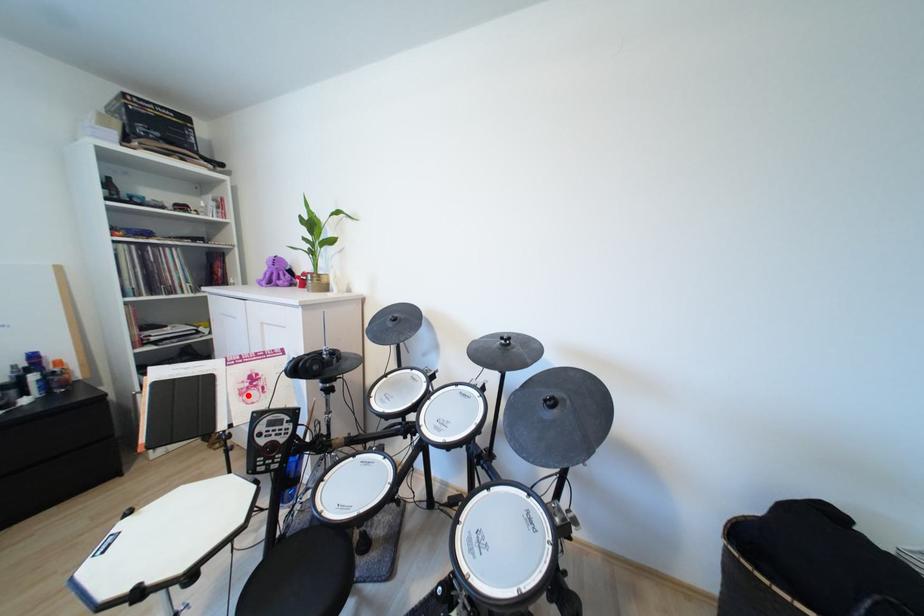
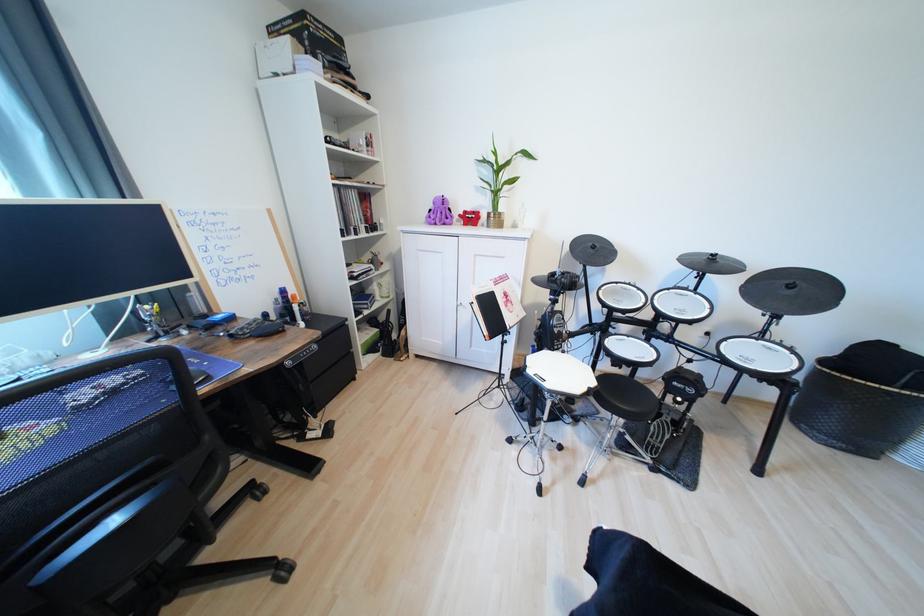
Where in the second image is the point corresponding to the highlighted location from the first image?

(513, 307)